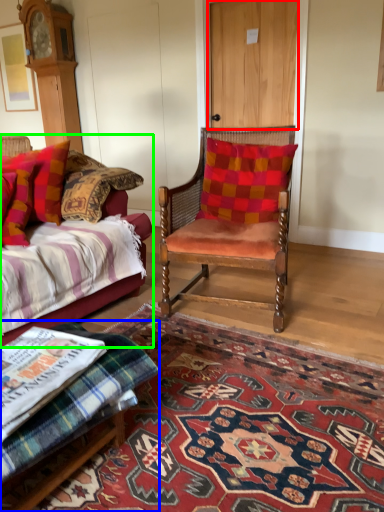
Question: Which object is the closest to the door (highlighted by a red box)? Choose among these: footrest (highlighted by a blue box) or studio couch (highlighted by a green box).

Choices:
 (A) footrest
 (B) studio couch

Answer: (B)